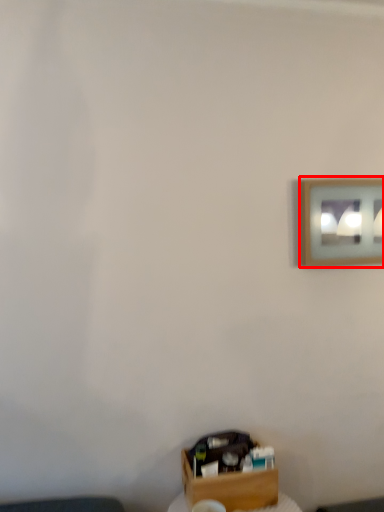
Question: From the image's perspective, considering the relative positions of picture frame (annotated by the red box) and box in the image provided, where is picture frame (annotated by the red box) located with respect to the staircase?

Choices:
 (A) below
 (B) above

Answer: (B)